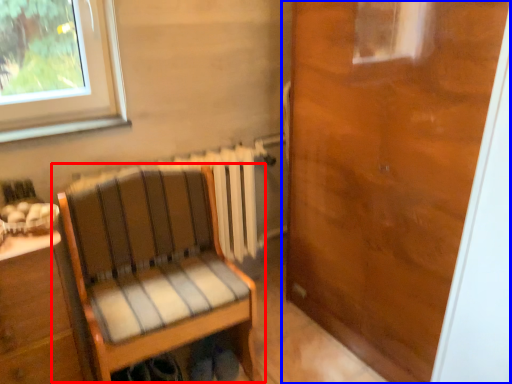
Question: Which object is closer to the camera taking this photo, chair (highlighted by a red box) or door (highlighted by a blue box)?

Choices:
 (A) chair
 (B) door

Answer: (B)